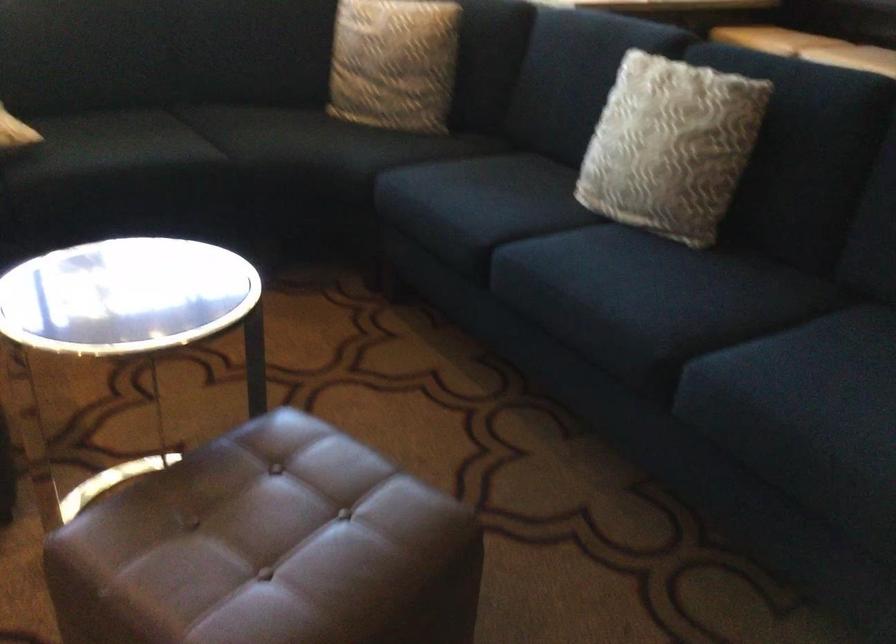
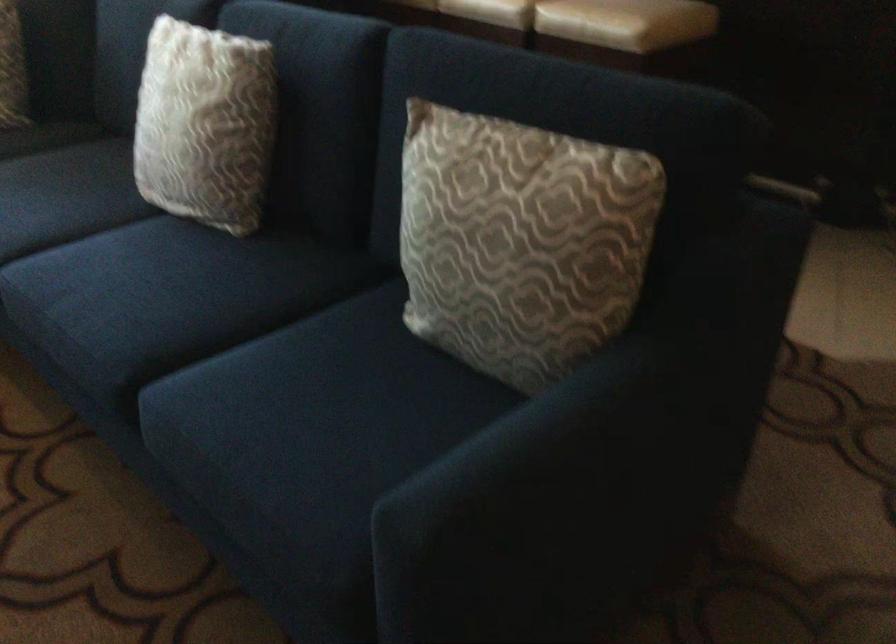
Question: The camera is either moving clockwise (left) or counter-clockwise (right) around the object. The first image is from the beginning of the video and the second image is from the end. Is the camera moving left or right when shooting the video?

Choices:
 (A) Left
 (B) Right

Answer: (A)